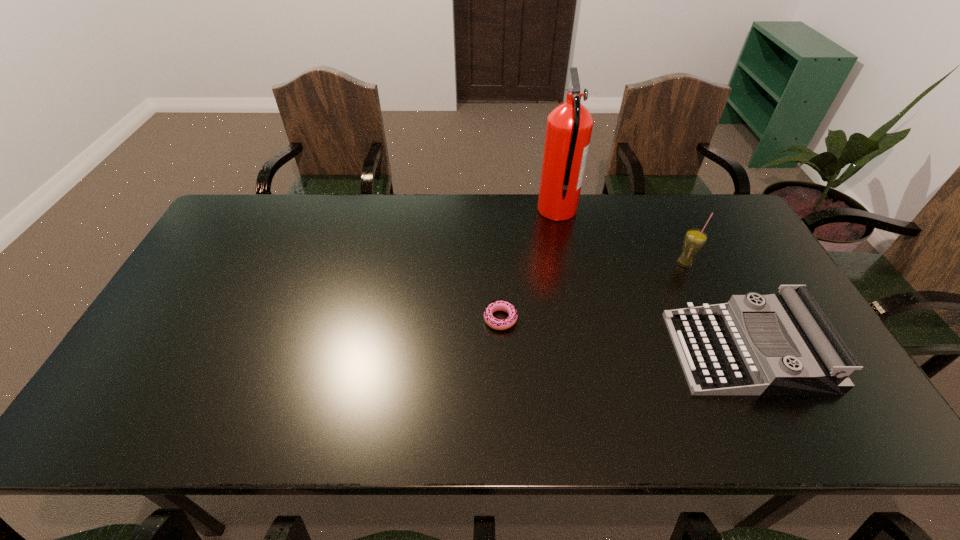
Identify the location of free region at the far right corner of the desktop. The height and width of the screenshot is (540, 960). (735, 220).

Where is `vacant region at the near right corner`? vacant region at the near right corner is located at coordinates point(872,437).

Where is `free space between the second shortest object and the third object from right to left`? free space between the second shortest object and the third object from right to left is located at coordinates (652, 281).

Where is `free space between the fire extinguisher and the third tallest object`? This screenshot has width=960, height=540. free space between the fire extinguisher and the third tallest object is located at coordinates (652, 281).

Image resolution: width=960 pixels, height=540 pixels. Identify the location of free point between the fire extinguisher and the typewriter. (652, 281).

Locate an element on the screen. unoccupied area between the leftmost object and the farthest object is located at coordinates (529, 265).

Locate an element on the screen. free spot between the shortest object and the second farthest object is located at coordinates click(592, 291).

At what (x,y) coordinates should I click in order to perform the action: click on vacant point located between the tallest object and the second tallest object. Please return your answer as a coordinate pair (x, y). The image size is (960, 540). Looking at the image, I should click on (621, 237).

Locate an element on the screen. The image size is (960, 540). blank region between the leftmost object and the farthest object is located at coordinates (529, 265).

Identify the location of empty space between the leftmost object and the third shortest object. (592, 291).